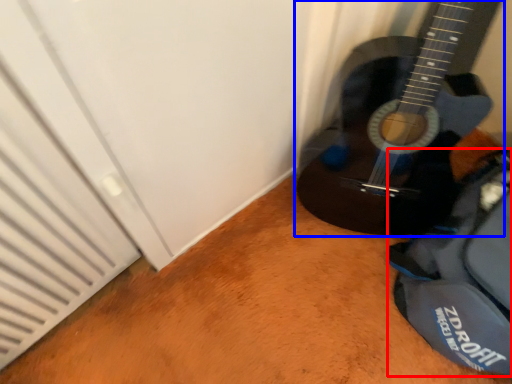
Question: Which of the following is the closest to the observer, messenger bag (highlighted by a red box) or guitar (highlighted by a blue box)?

Choices:
 (A) messenger bag
 (B) guitar

Answer: (B)